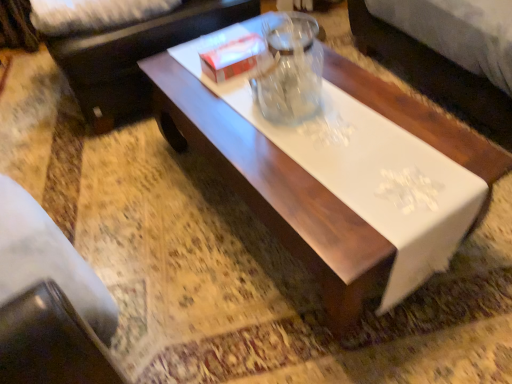
Question: Relative to dark brown leather couch at upper left, is white glossy coffee table at center in front or behind?

Choices:
 (A) front
 (B) behind

Answer: (A)

Question: In terms of size, does white glossy coffee table at center appear bigger or smaller than dark brown leather couch at upper left?

Choices:
 (A) big
 (B) small

Answer: (A)

Question: Which object is positioned farthest from the dark brown leather couch at upper left?

Choices:
 (A) white glossy coffee table at center
 (B) white cardboard box at center

Answer: (A)

Question: Estimate the real-world distances between objects in this image. Which object is farther from the white glossy coffee table at center?

Choices:
 (A) white cardboard box at center
 (B) dark brown leather couch at upper left

Answer: (B)